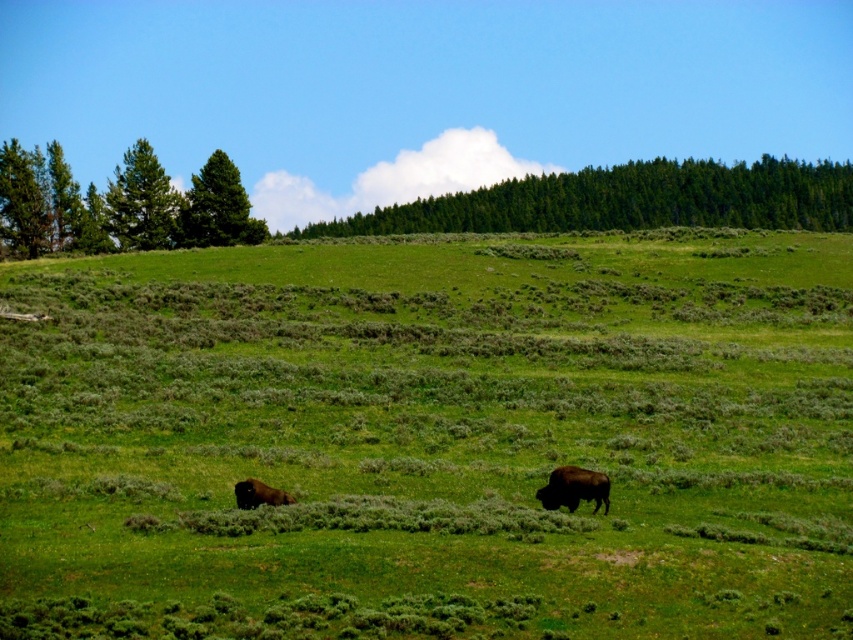
Who is lower down, green grassy field at center or green textured pine tree at upper left?

Positioned lower is green grassy field at center.

Can you confirm if green grassy field at center is positioned below green textured pine tree at upper left?

Yes.

Find the location of `green grassy field at center`. green grassy field at center is located at coordinates (430, 438).

The height and width of the screenshot is (640, 853). Identify the location of green coniferous trees at left. (119, 205).

Which is behind, point (71, 182) or point (224, 205)?

Point (71, 182)

Image resolution: width=853 pixels, height=640 pixels. I want to click on green coniferous trees at left, so click(x=119, y=205).

Does green textured pine tree at upper left appear on the right side of brown furry bison at lower right?

In fact, green textured pine tree at upper left is to the left of brown furry bison at lower right.

This screenshot has width=853, height=640. I want to click on green textured pine tree at upper left, so click(141, 202).

You are a GUI agent. You are given a task and a screenshot of the screen. Output one action in this format:
    pyautogui.click(x=<x>, y=<y>)
    Task: Click on the green textured pine tree at upper left
    The width and height of the screenshot is (853, 640).
    Given the screenshot: What is the action you would take?
    click(x=141, y=202)